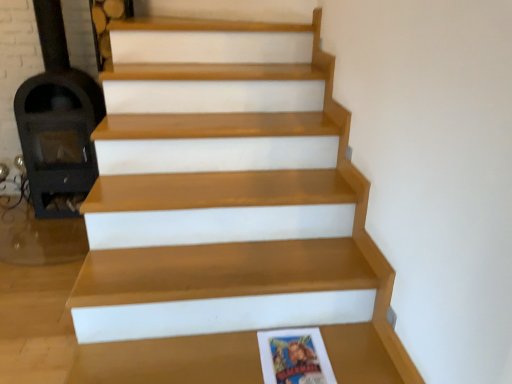
Where is `black matte fireplace at left`? The height and width of the screenshot is (384, 512). black matte fireplace at left is located at coordinates (58, 122).

Describe the element at coordinates (58, 122) in the screenshot. I see `black matte fireplace at left` at that location.

This screenshot has height=384, width=512. I want to click on black matte fireplace at left, so click(x=58, y=122).